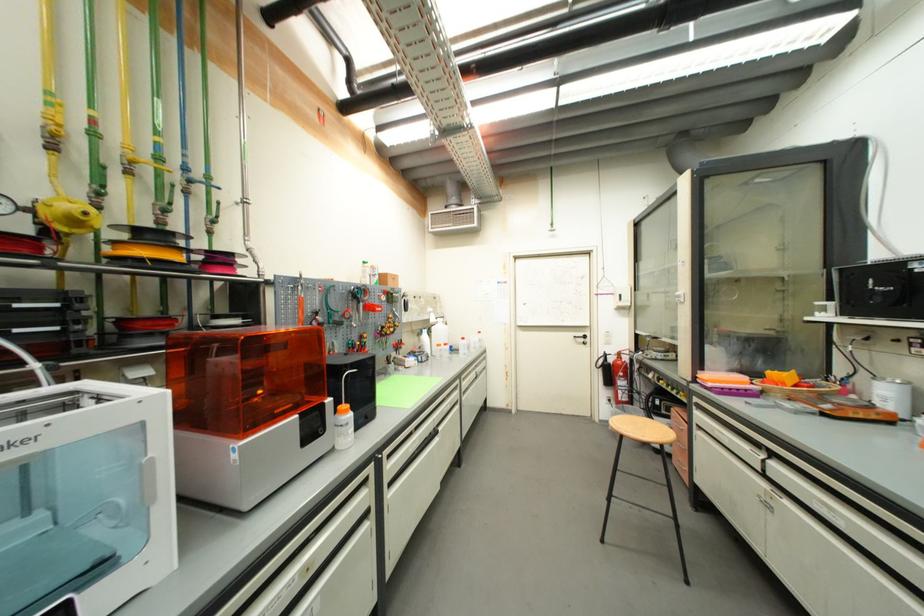
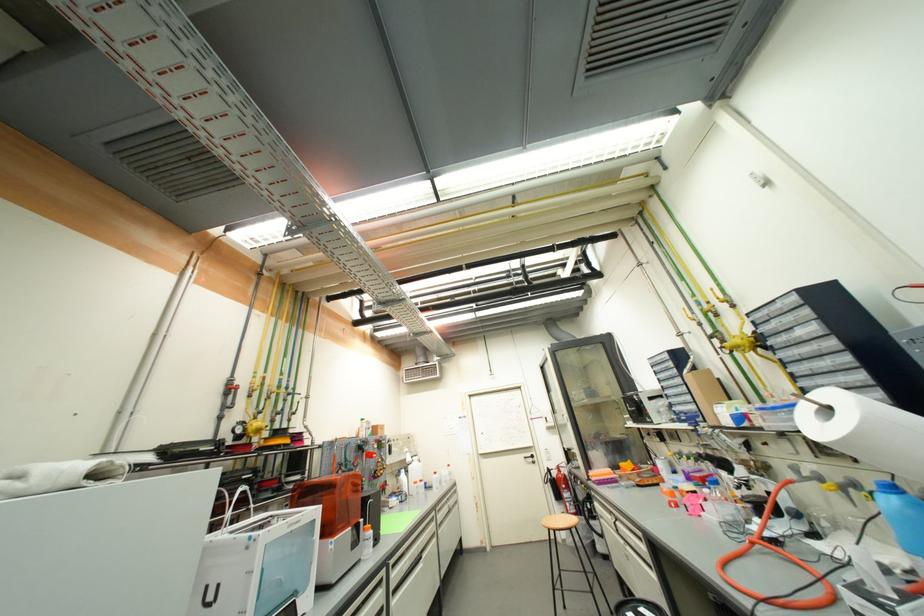
Question: The images are taken continuously from a first-person perspective. In which direction are you moving?

Choices:
 (A) Left
 (B) Right
 (C) Forward
 (D) Backward

Answer: (D)